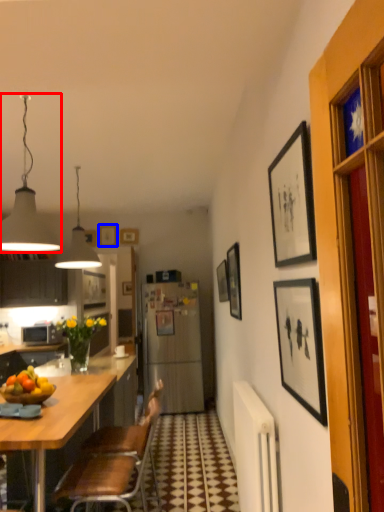
Question: Which object appears farthest to the camera in this image, lamp (highlighted by a red box) or picture frame (highlighted by a blue box)?

Choices:
 (A) lamp
 (B) picture frame

Answer: (B)